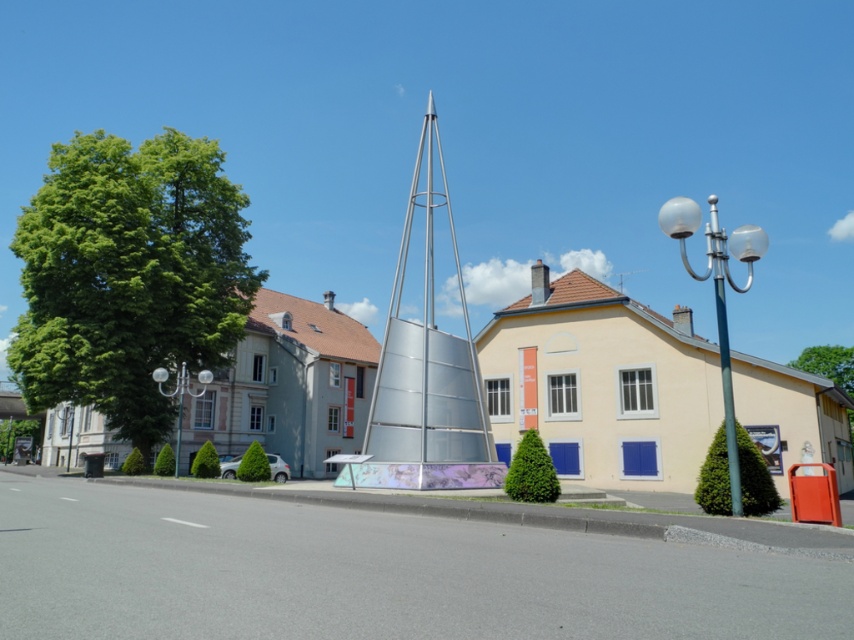
Question: In this image, where is metallic silver spire at center located relative to green leafy tree at lower left?

Choices:
 (A) below
 (B) above

Answer: (B)

Question: Observing the image, what is the correct spatial positioning of green leafy tree at right in reference to green leafy tree at lower left?

Choices:
 (A) left
 (B) right

Answer: (B)

Question: Can you confirm if green metallic streetlight at upper right is positioned to the right of white glass lamp post at left?

Choices:
 (A) yes
 (B) no

Answer: (A)

Question: Estimate the real-world distances between objects in this image. Which object is farther from the green metallic streetlight at upper right?

Choices:
 (A) green leafy bush at center
 (B) green leafy tree at right
 (C) metallic silver spire at center

Answer: (A)

Question: Which object is farther from the camera taking this photo?

Choices:
 (A) green leafy tree at lower left
 (B) metallic silver spire at center
 (C) green metallic streetlight at upper right

Answer: (A)

Question: Which object is the farthest from the metallic silver spire at center?

Choices:
 (A) green leafy tree at right
 (B) green leafy tree at lower left

Answer: (A)